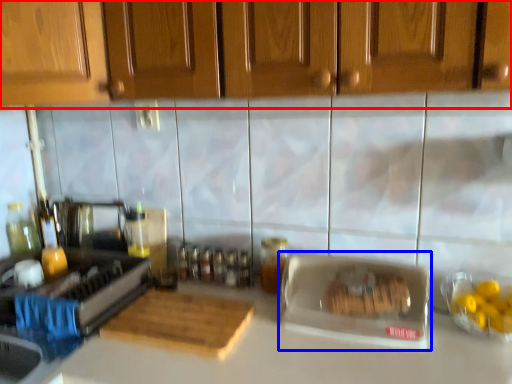
Question: Among these objects, which one is farthest to the camera, cabinetry (highlighted by a red box) or appliance (highlighted by a blue box)?

Choices:
 (A) cabinetry
 (B) appliance

Answer: (B)